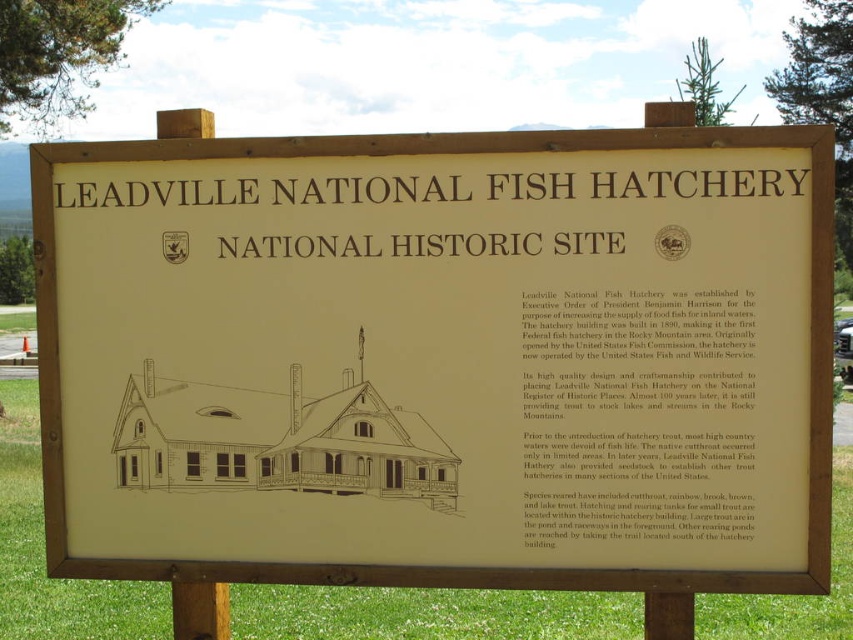
Question: In this image, where is matte paper text at center located relative to beige/wooden sign at upper center?

Choices:
 (A) above
 (B) below

Answer: (B)

Question: Which of these objects is positioned closest to the beige paper sign at center?

Choices:
 (A) matte paper text at center
 (B) beige/wooden sign at upper center

Answer: (A)

Question: Which of the following is the farthest from the observer?

Choices:
 (A) matte paper text at center
 (B) beige/wooden sign at upper center

Answer: (A)

Question: Observing the image, what is the correct spatial positioning of beige paper sign at center in reference to matte paper text at center?

Choices:
 (A) left
 (B) right

Answer: (A)

Question: Which point is closer to the camera taking this photo?

Choices:
 (A) (599, 177)
 (B) (646, 218)

Answer: (A)

Question: Where is beige paper sign at center located in relation to matte paper text at center in the image?

Choices:
 (A) above
 (B) below

Answer: (A)